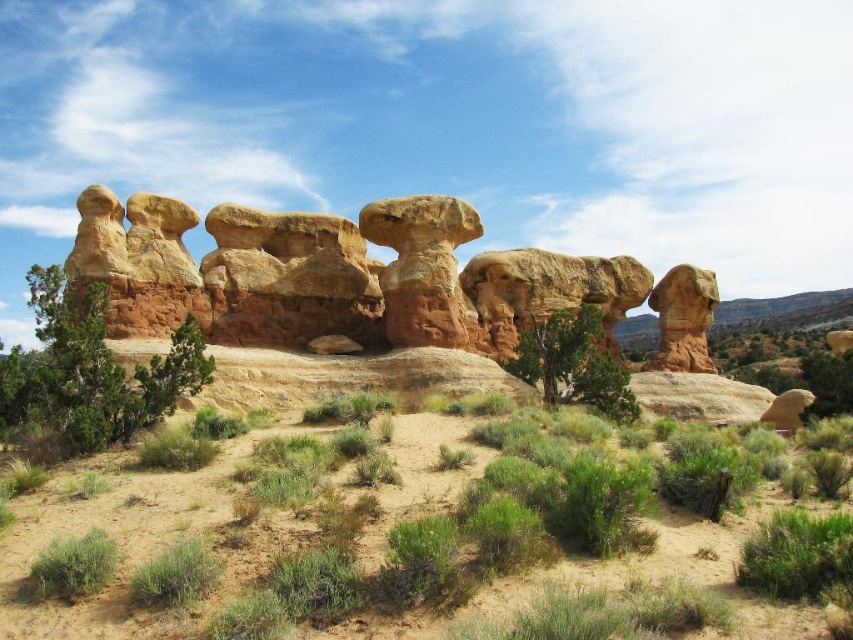
Measure the distance between rustic sandstone rock formation at center and camera.

88.19 meters

Is rustic sandstone rock formation at center wider than green leafy bush at center?

Correct, the width of rustic sandstone rock formation at center exceeds that of green leafy bush at center.

Is point (440, 253) positioned after point (541, 321)?

No, it is not.

At what (x,y) coordinates should I click in order to perform the action: click on rustic sandstone rock formation at center. Please return your answer as a coordinate pair (x, y). Looking at the image, I should click on (364, 278).

Is dull orange rock formation at center closer to camera compared to green shrub at left?

Yes, it is.

Is dull orange rock formation at center to the right of green shrub at left from the viewer's perspective?

Correct, you'll find dull orange rock formation at center to the right of green shrub at left.

Where is `dull orange rock formation at center`? This screenshot has width=853, height=640. dull orange rock formation at center is located at coordinates (392, 532).

Find the location of a particular element. This screenshot has height=640, width=853. dull orange rock formation at center is located at coordinates (392, 532).

Who is shorter, dull orange rock formation at center or rustic sandstone rock formation at center?

dull orange rock formation at center is shorter.

Between point (656, 496) and point (450, 248), which one is positioned in front?

Point (656, 496) is more forward.

Where is `dull orange rock formation at center`? This screenshot has height=640, width=853. dull orange rock formation at center is located at coordinates (392, 532).